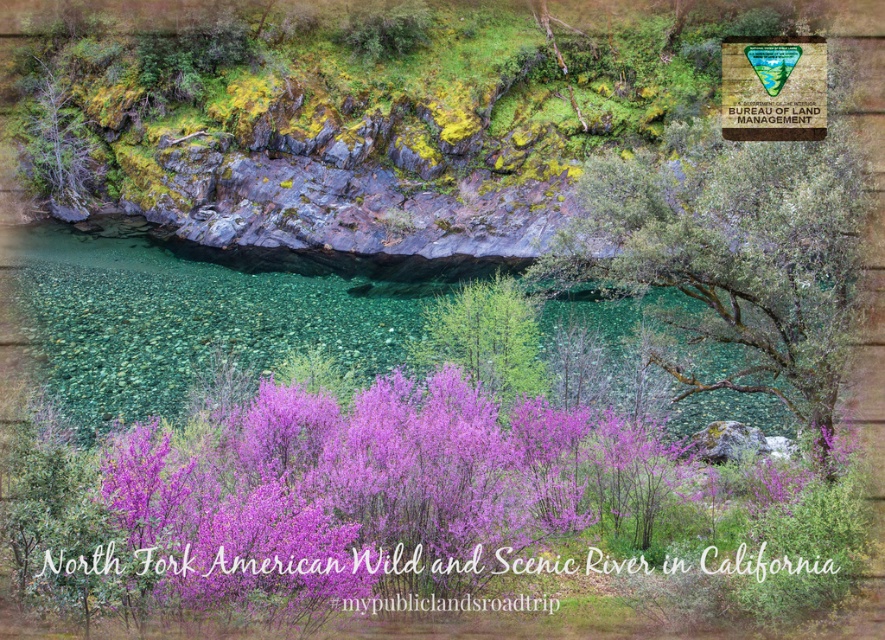
Question: Among these objects, which one is farthest from the camera?

Choices:
 (A) green leafy tree at center-right
 (B) purple leafy tree at center
 (C) wooden sign at upper right

Answer: (B)

Question: Which point is closer to the camera taking this photo?

Choices:
 (A) (437, 429)
 (B) (483, 356)
 (C) (747, 273)
 (D) (736, 58)

Answer: (A)

Question: Is green leafy tree at center-right below purple leafy tree at center?

Choices:
 (A) yes
 (B) no

Answer: (B)

Question: Can you confirm if purple bloom at center is bigger than wooden sign at upper right?

Choices:
 (A) yes
 (B) no

Answer: (B)

Question: Which object is positioned closest to the green leafy tree at center-right?

Choices:
 (A) purple bloom at center
 (B) purple leafy tree at center

Answer: (A)

Question: Is green leafy tree at center-right thinner than wooden sign at upper right?

Choices:
 (A) yes
 (B) no

Answer: (A)